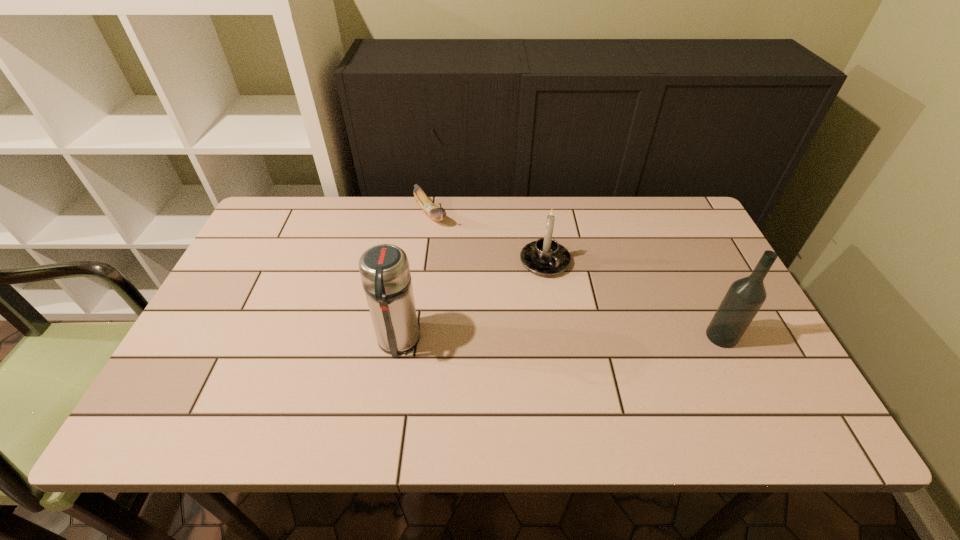
Locate an element on the screen. Image resolution: width=960 pixels, height=540 pixels. blank region between the vodka and the thermos bottle is located at coordinates (560, 339).

Where is `vacant area that lies between the banana and the thermos bottle`? This screenshot has width=960, height=540. vacant area that lies between the banana and the thermos bottle is located at coordinates (414, 279).

The height and width of the screenshot is (540, 960). I want to click on free spot between the thermos bottle and the second farthest object, so click(471, 302).

Where is `free space that is in between the banana and the third nearest object`? The image size is (960, 540). free space that is in between the banana and the third nearest object is located at coordinates (488, 238).

Find the location of `vacant space that is in between the second object from right to left and the shortest object`. vacant space that is in between the second object from right to left and the shortest object is located at coordinates (488, 238).

Point out which object is positioned as the second nearest to the rightmost object. Please provide its 2D coordinates. Your answer should be formatted as a tuple, i.e. [(x, y)], where the tuple contains the x and y coordinates of a point satisfying the conditions above.

[(384, 269)]

Identify the location of object identified as the third closest to the third nearest object. This screenshot has width=960, height=540. (744, 298).

Where is `vacant space that satisfies the following two spatial constraints: 1. on the front side of the candle holder; 2. on the left side of the shortest object`? This screenshot has width=960, height=540. vacant space that satisfies the following two spatial constraints: 1. on the front side of the candle holder; 2. on the left side of the shortest object is located at coordinates (424, 261).

Where is `vacant space that satisfies the following two spatial constraints: 1. on the front side of the banana; 2. on the right side of the vodka`? The height and width of the screenshot is (540, 960). vacant space that satisfies the following two spatial constraints: 1. on the front side of the banana; 2. on the right side of the vodka is located at coordinates (415, 336).

Identify the location of vacant space that satisfies the following two spatial constraints: 1. on the front side of the rightmost object; 2. on the right side of the second farthest object. The image size is (960, 540). (556, 336).